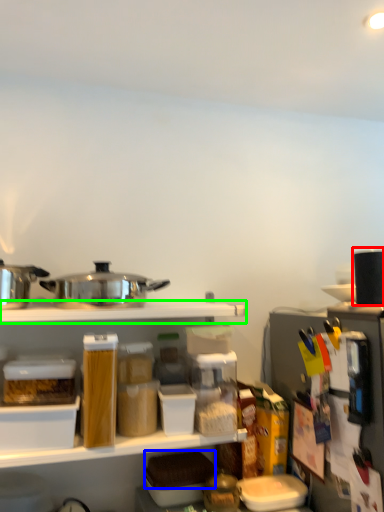
Question: Which object is the farthest from appliance (highlighted by a red box)? Choose among these: food (highlighted by a blue box) or shelf (highlighted by a green box).

Choices:
 (A) food
 (B) shelf

Answer: (A)